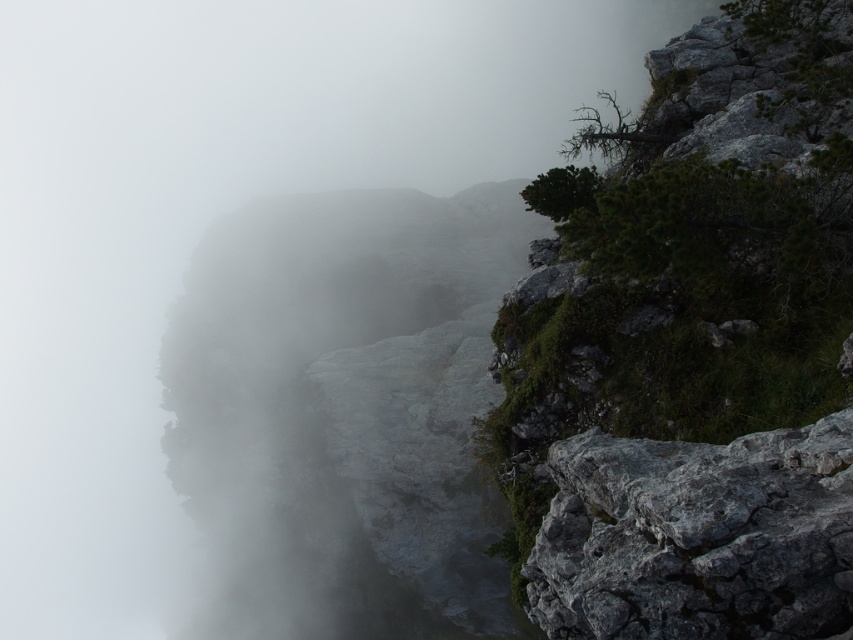
Question: Which point is farther from the camera taking this photo?

Choices:
 (A) pyautogui.click(x=746, y=572)
 (B) pyautogui.click(x=722, y=625)
 (C) pyautogui.click(x=242, y=378)

Answer: (C)

Question: Is rough gray rock at right below white misty cloud at left?

Choices:
 (A) no
 (B) yes

Answer: (A)

Question: Can you confirm if rough gray rock at right is wider than gray rough rock at lower right?

Choices:
 (A) no
 (B) yes

Answer: (B)

Question: Which of these objects is positioned closest to the gray rough rock at lower right?

Choices:
 (A) white misty cloud at left
 (B) rough gray rock at right

Answer: (B)

Question: Which object appears farthest from the camera in this image?

Choices:
 (A) rough gray rock at right
 (B) gray rough rock at lower right
 (C) white misty cloud at left

Answer: (C)

Question: Is rough gray rock at right smaller than white misty cloud at left?

Choices:
 (A) yes
 (B) no

Answer: (A)